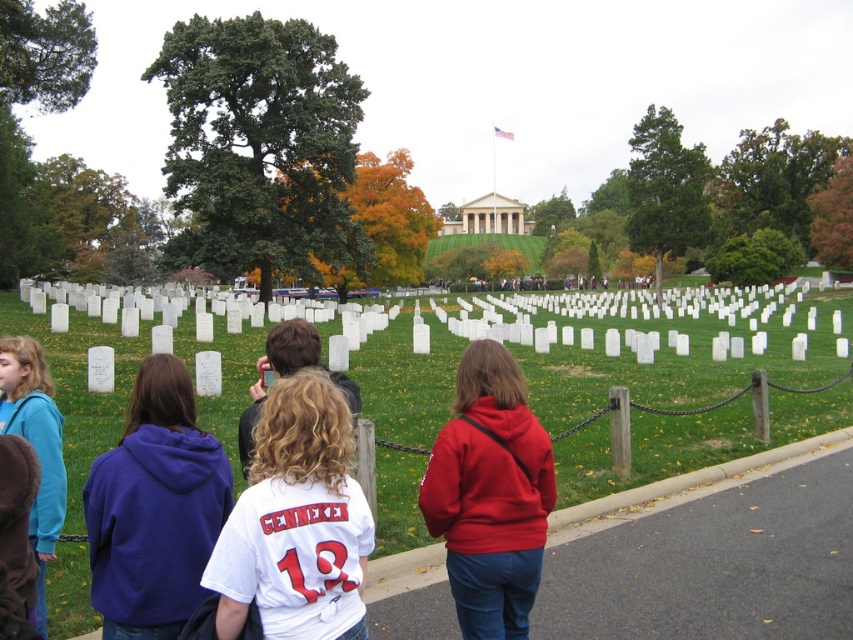
You are a photographer trying to capture a photo of the red matte hoodie at center and the white matte gravestones at center. Since you want the gravestones to appear larger in the photo than the hoodie, where should you position yourself relative to them?

To make the white matte gravestones at center appear larger than the red matte hoodie at center in the photo, you should move closer to the white matte gravestones at center. Since the gravestones are already taller than the hoodie, positioning yourself closer to them will emphasize their size relative to the hoodie.

Consider the image. You are a photographer planning to take a group photo of the people at the cemetery. You need to ensure that all subjects are fully visible. Considering the purple hoodie at center and the curly blonde hair at center, which one might require more space to the sides to avoid being cropped out?

The purple hoodie at center requires more space to the sides because its width is larger than the curly blonde hair at center, so it is more likely to be cropped out if not given enough space.

Consider the image. You are a photographer standing at the beginning of the pathway. You want to take a photo of the white matte gravestones at center so that they are in sharp focus. Your camera has a depth of field that can clearly capture objects within a 5 meter range. Will the gravestones be in focus if you focus on them?

The white matte gravestones at center are 5.25 meters away from the camera. Since the depth of field can only clearly capture objects within 5 meters, the gravestones are slightly beyond the optimal range. They might be slightly out of focus unless adjustments are made, such as increasing the depth of field or moving closer.